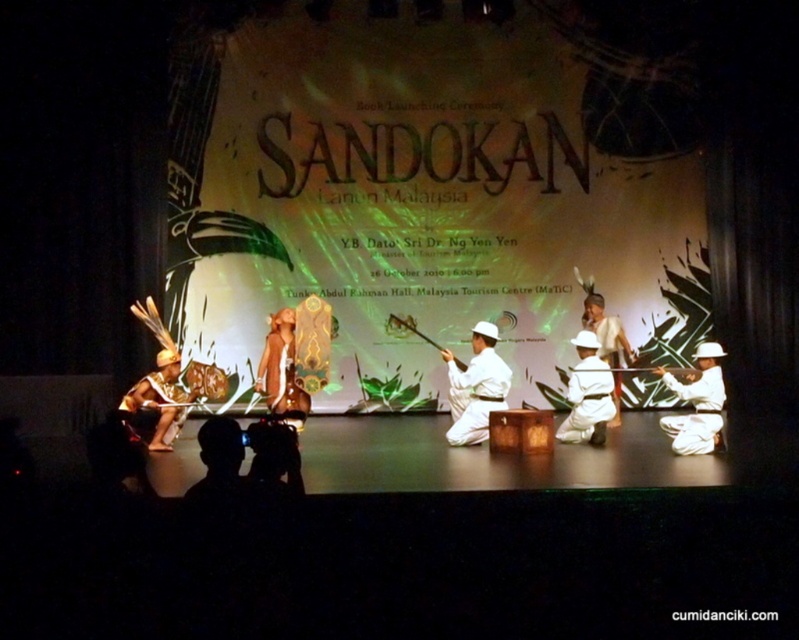
You are an event organizer checking the stage setup for the book launch of Sandokan. You notice the white matte helmet at center and the white matte uniform at center. Which object is wider from the audience perspective?

The white matte helmet at center is wider than the white matte uniform at center from the audience perspective.

Based on the photo, you are an event photographer positioned at the back of the stage. You want to capture a clear photo of the white matte uniform at center and the silhouette fabric at lower center. Which object should you focus on first to ensure both are in sharp focus?

The silhouette fabric at lower center is behind the white matte uniform at center, so you should focus on the white matte uniform at center first. This way, both objects will be in sharp focus since the silhouette fabric is farther away.